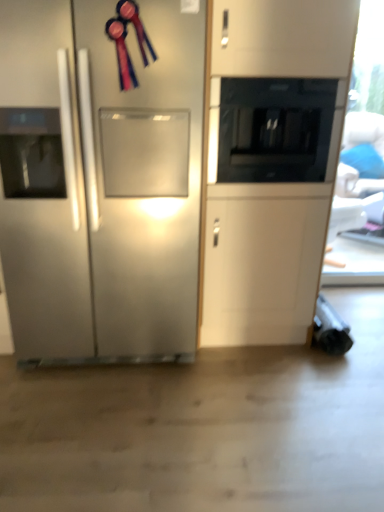
Question: Considering their positions, is black glass microwave at upper center located in front of or behind stainless steel refrigerator at left?

Choices:
 (A) front
 (B) behind

Answer: (B)

Question: From the image's perspective, is black glass microwave at upper center located above or below stainless steel refrigerator at left?

Choices:
 (A) below
 (B) above

Answer: (B)

Question: From a real-world perspective, is black glass microwave at upper center positioned above or below stainless steel refrigerator at left?

Choices:
 (A) above
 (B) below

Answer: (A)

Question: In terms of size, does stainless steel refrigerator at left appear bigger or smaller than black glass microwave at upper center?

Choices:
 (A) big
 (B) small

Answer: (A)

Question: Considering the positions of point (46, 177) and point (230, 169), is point (46, 177) closer or farther from the camera than point (230, 169)?

Choices:
 (A) closer
 (B) farther

Answer: (A)

Question: From a real-world perspective, relative to black glass microwave at upper center, is stainless steel refrigerator at left vertically above or below?

Choices:
 (A) below
 (B) above

Answer: (A)

Question: From the image's perspective, relative to black glass microwave at upper center, is stainless steel refrigerator at left above or below?

Choices:
 (A) below
 (B) above

Answer: (A)